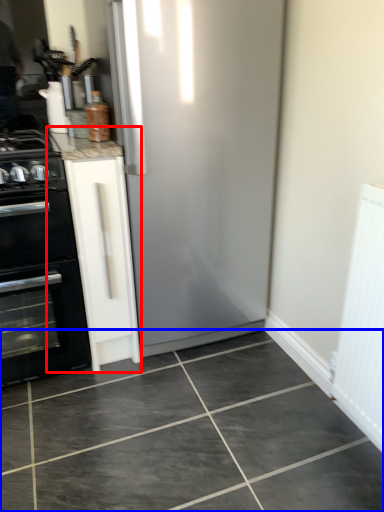
Question: Which object appears farthest to the camera in this image, cabinetry (highlighted by a red box) or ceramic tile (highlighted by a blue box)?

Choices:
 (A) cabinetry
 (B) ceramic tile

Answer: (A)